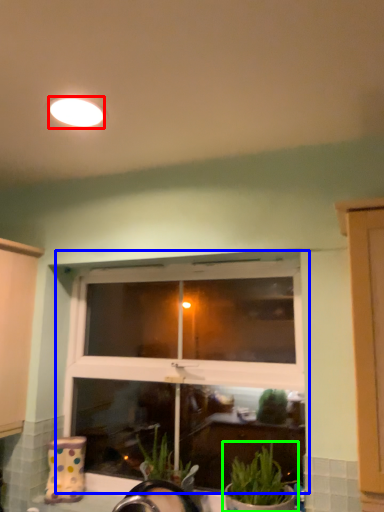
Question: Which is farther away from lighting (highlighted by a red box)? window (highlighted by a blue box) or houseplant (highlighted by a green box)?

Choices:
 (A) window
 (B) houseplant

Answer: (B)